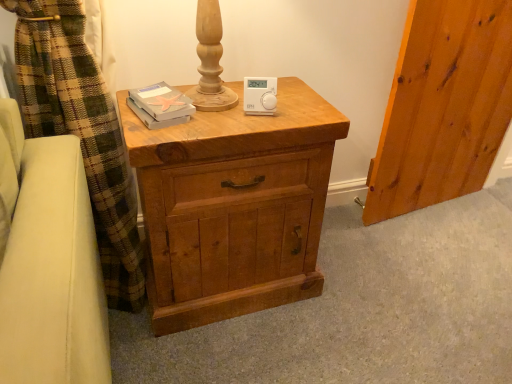
Where is `white plastic thermostat at center`? white plastic thermostat at center is located at coordinates (260, 95).

The height and width of the screenshot is (384, 512). Find the location of `matte wood chest of drawers at center`. matte wood chest of drawers at center is located at coordinates (234, 206).

Locate an element on the screen. matte gray book at upper left is located at coordinates tap(160, 105).

I want to click on white plastic thermostat at center, so click(x=260, y=95).

From a real-world perspective, is matte gray book at upper left positioned under matte wood chest of drawers at center based on gravity?

No, from a real-world perspective, matte gray book at upper left is not beneath matte wood chest of drawers at center.

Is matte gray book at upper left far away from matte wood chest of drawers at center?

matte gray book at upper left is actually quite close to matte wood chest of drawers at center.

The height and width of the screenshot is (384, 512). I want to click on the chest of drawers located in front of the matte gray book at upper left, so click(x=234, y=206).

From the image's perspective, is matte gray book at upper left above or below matte wood chest of drawers at center?

Based on their image positions, matte gray book at upper left is located above matte wood chest of drawers at center.

Would you say white plastic thermostat at center is inside or outside matte wood chest of drawers at center?

white plastic thermostat at center is not enclosed by matte wood chest of drawers at center.

Does point (269, 92) come closer to viewer compared to point (216, 135)?

No.

Which is more to the left, white plastic thermostat at center or matte wood chest of drawers at center?

matte wood chest of drawers at center is more to the left.

You are a GUI agent. You are given a task and a screenshot of the screen. Output one action in this format:
    pyautogui.click(x=<x>, y=<y>)
    Task: Click on the chest of drawers lying on the left of white plastic thermostat at center
    This screenshot has height=384, width=512.
    Given the screenshot: What is the action you would take?
    pyautogui.click(x=234, y=206)

Which is in front, matte gray book at upper left or white plastic thermostat at center?

matte gray book at upper left is in front.

Considering the sizes of objects matte gray book at upper left and white plastic thermostat at center in the image provided, who is shorter, matte gray book at upper left or white plastic thermostat at center?

matte gray book at upper left is shorter.

From the image's perspective, is matte gray book at upper left located above white plastic thermostat at center?

Incorrect, from the image's perspective, matte gray book at upper left is lower than white plastic thermostat at center.

Is matte gray book at upper left far away from white plastic thermostat at center?

Actually, matte gray book at upper left and white plastic thermostat at center are a little close together.

Does matte wood chest of drawers at center have a lesser width compared to white plastic thermostat at center?

No, matte wood chest of drawers at center is not thinner than white plastic thermostat at center.

How different are the orientations of matte wood chest of drawers at center and white plastic thermostat at center in degrees?

15.5 degrees.

Is matte wood chest of drawers at center shorter than white plastic thermostat at center?

No.

Is point (330, 171) closer to viewer compared to point (260, 83)?

No, (330, 171) is further to viewer.

Which object is thinner, matte wood chest of drawers at center or matte gray book at upper left?

Thinner between the two is matte gray book at upper left.

Which is less distant, (x=215, y=316) or (x=170, y=106)?

Point (x=215, y=316) is farther from the camera than point (x=170, y=106).

Looking at this image, is matte gray book at upper left at the back of matte wood chest of drawers at center?

No.

Is matte wood chest of drawers at center taller than matte gray book at upper left?

Yes.

Is white plastic thermostat at center not near matte gray book at upper left?

No, there isn't a large distance between white plastic thermostat at center and matte gray book at upper left.

Is white plastic thermostat at center thinner than matte gray book at upper left?

Yes, white plastic thermostat at center is thinner than matte gray book at upper left.

From the image's perspective, would you say white plastic thermostat at center is shown under matte gray book at upper left?

Actually, white plastic thermostat at center appears above matte gray book at upper left in the image.

Is white plastic thermostat at center turned away from matte gray book at upper left?

No, white plastic thermostat at center is not facing the opposite direction of matte gray book at upper left.

At what (x,y) coordinates should I click in order to perform the action: click on book behind the matte wood chest of drawers at center. Please return your answer as a coordinate pair (x, y). The width and height of the screenshot is (512, 384). Looking at the image, I should click on (160, 105).

Where is `the chest of drawers located below the white plastic thermostat at center (from the image's perspective)`? The width and height of the screenshot is (512, 384). the chest of drawers located below the white plastic thermostat at center (from the image's perspective) is located at coordinates (234, 206).

Looking at this image, from the image, which object appears to be nearer to matte wood chest of drawers at center, matte gray book at upper left or white plastic thermostat at center?

The object closer to matte wood chest of drawers at center is matte gray book at upper left.

Based on their spatial positions, is matte gray book at upper left or matte wood chest of drawers at center further from white plastic thermostat at center?

matte wood chest of drawers at center lies further to white plastic thermostat at center than the other object.

Looking at the image, which one is located further to matte wood chest of drawers at center, white plastic thermostat at center or matte gray book at upper left?

white plastic thermostat at center is positioned further to the anchor matte wood chest of drawers at center.

Looking at the image, which one is located further to white plastic thermostat at center, matte wood chest of drawers at center or matte gray book at upper left?

matte wood chest of drawers at center.

From the picture: Which object lies nearer to the anchor point matte gray book at upper left, white plastic thermostat at center or matte wood chest of drawers at center?

white plastic thermostat at center is closer to matte gray book at upper left.

When comparing their distances from matte gray book at upper left, does matte wood chest of drawers at center or white plastic thermostat at center seem closer?

Based on the image, white plastic thermostat at center appears to be nearer to matte gray book at upper left.

I want to click on book that lies between white plastic thermostat at center and matte wood chest of drawers at center from top to bottom, so click(160, 105).